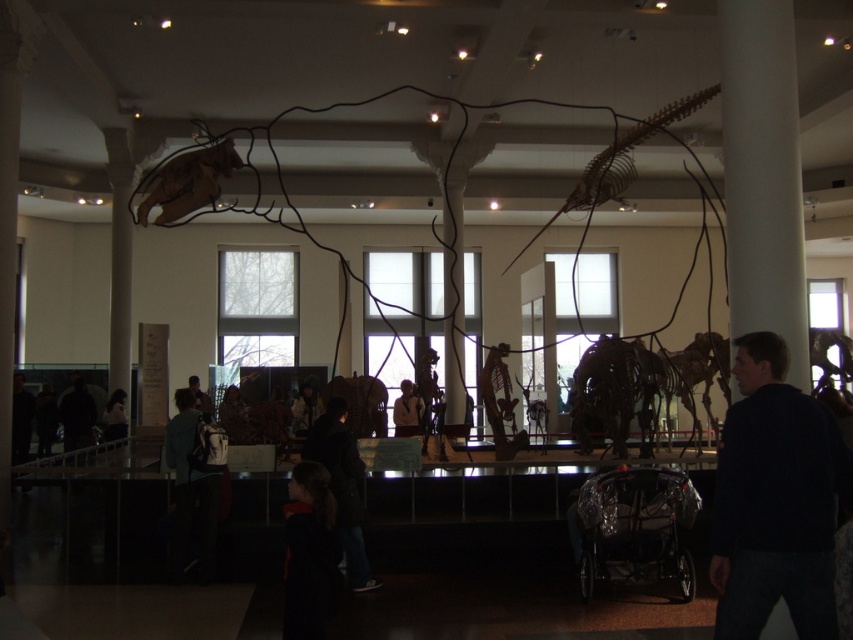
You are a visitor in the museum and want to take a photo of the white fabric coat at center without the brown matte dinosaur at upper left blocking the view. Is this possible?

The brown matte dinosaur at upper left is in front of the white fabric coat at center, so it is blocking the view. To take a photo of the white fabric coat at center without the brown matte dinosaur at upper left blocking the view, you would need to move around to a position where the dinosaur is not in front of the coat.

You are an art student visiting the museum and want to sketch both the dark blue jacket at left and the white fabric coat at center. Which one should you sketch first if you want to start with the one closer to the entrance?

The dark blue jacket at left is to the left of the white fabric coat at center. Since the entrance is typically on the left side of such spaces, you should sketch the dark blue jacket at left first as it is closer to the entrance.

You are standing in the museum and see a point marked at coordinates (341, 486). Based on the scene description, what object is located at that point?

The point at coordinates (341, 486) is located on dark blue jeans at center.